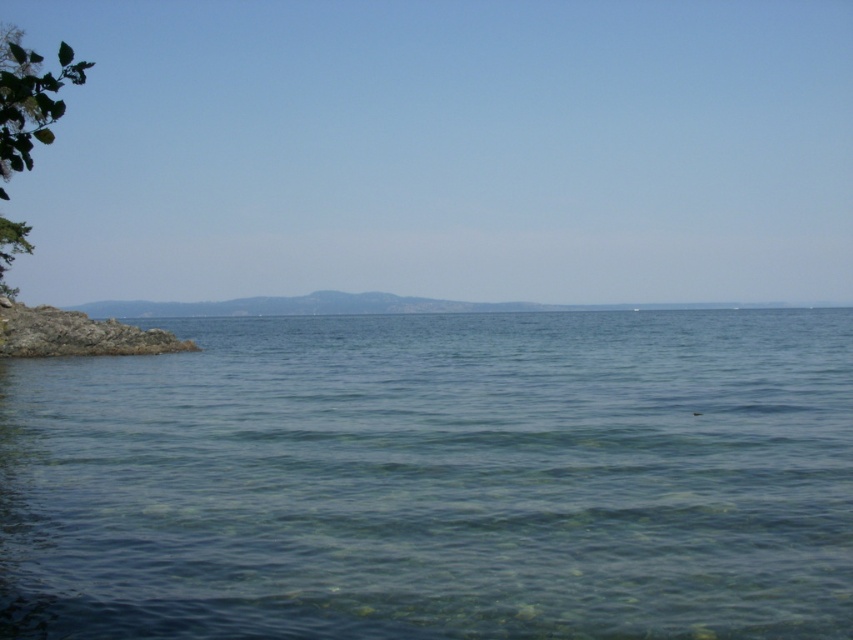
Which of these two, clear water at left or rocky shore at lower left, stands taller?

Standing taller between the two is clear water at left.

Does clear water at left have a lesser height compared to rocky shore at lower left?

No.

Which is behind, point (782, 396) or point (68, 353)?

The point (68, 353) is more distant.

You are a GUI agent. You are given a task and a screenshot of the screen. Output one action in this format:
    pyautogui.click(x=<x>, y=<y>)
    Task: Click on the clear water at left
    This screenshot has height=640, width=853.
    Given the screenshot: What is the action you would take?
    [436, 480]